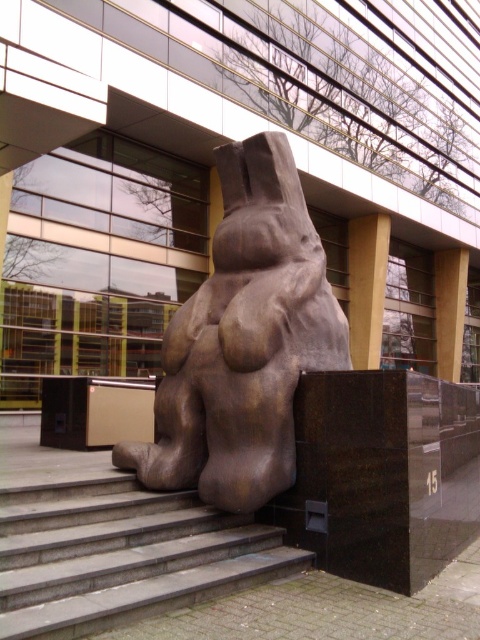
You are an architect standing at the entrance of the building and want to reach the bronze sculpture at center. Which direction should you walk relative to the smooth concrete stairs at center?

The bronze sculpture at center is closer to you than the smooth concrete stairs at center, so you should walk towards the bronze sculpture at center directly ahead of you.

You are a delivery person carrying a package that requires a clear path to the front entrance of the building. You see the bronze sculpture at center and the smooth concrete stairs at center. Is there enough space between them for you to walk through comfortably?

The bronze sculpture at center is 3.86 feet from the smooth concrete stairs at center. Since 3.86 feet is approximately 46 inches, which is more than enough space for a person to walk through comfortably, you can proceed safely between them.